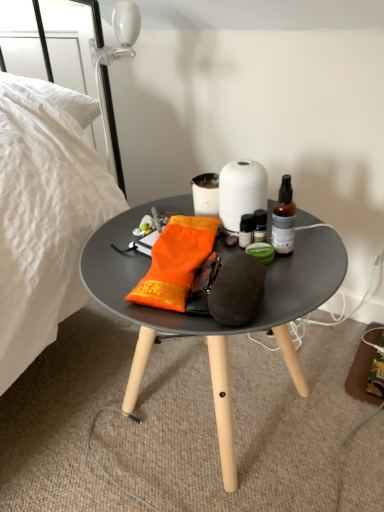
Identify the location of vacant area situated below matte gray coffee table at center (from a real-world perspective). (201, 410).